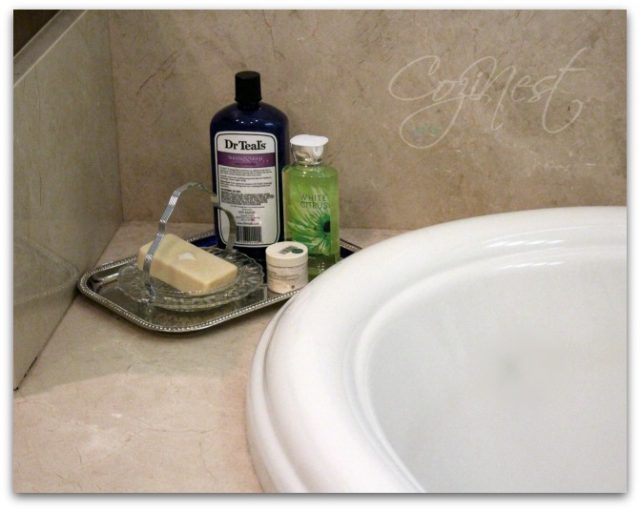
Where is `bottle`? The width and height of the screenshot is (640, 510). bottle is located at coordinates (326, 181).